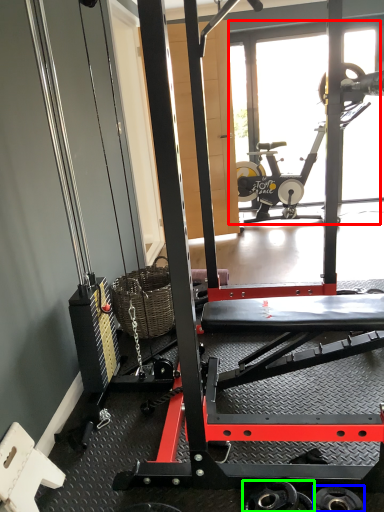
Question: Which is nearer to the glass door (highlighted by a red box)? wheel (highlighted by a blue box) or wheel (highlighted by a green box).

Choices:
 (A) wheel
 (B) wheel

Answer: (B)